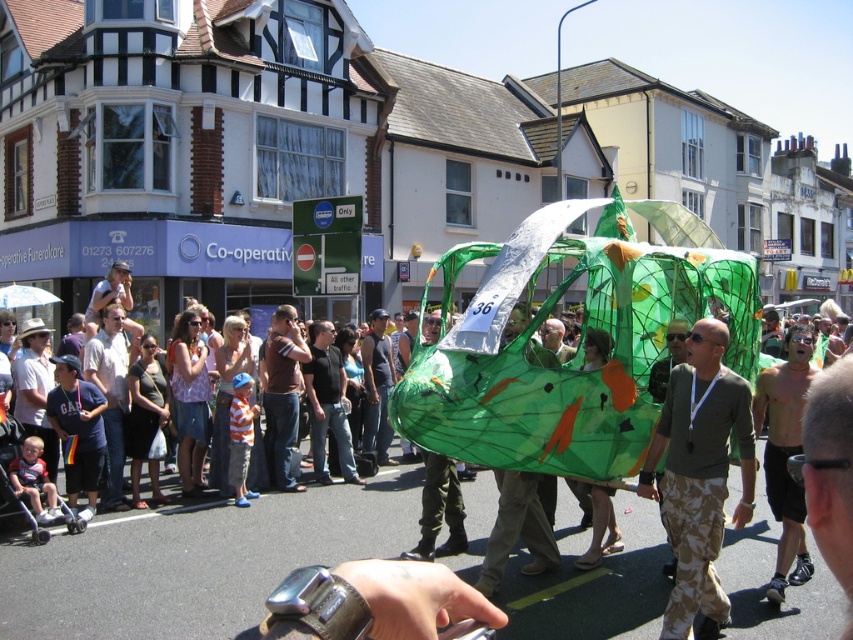
You are a photographer at the parade and want to capture both the dark brown shirt at center and the light brown cotton shirt at center in a single shot. Which shirt should you focus on first to ensure both are in frame?

You should focus on the dark brown shirt at center first since it is taller than the light brown cotton shirt at center, ensuring both can be captured in the frame.

You are standing at the origin point of the image. You want to find the dark brown shirt at center. In which direction should you look to locate it?

The dark brown shirt at center is located at point 0.617 on the x axis and 0.331 on the y axis. Since the origin is at the bottom left corner of the image, you should look to the upper right direction to locate it.